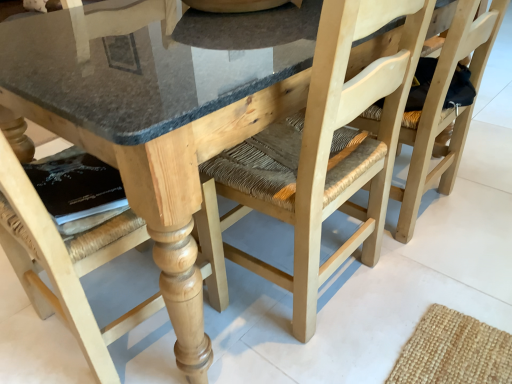
I want to click on vacant area that lies to the right of natural wood chair at center, the first chair positioned from the right, so click(484, 187).